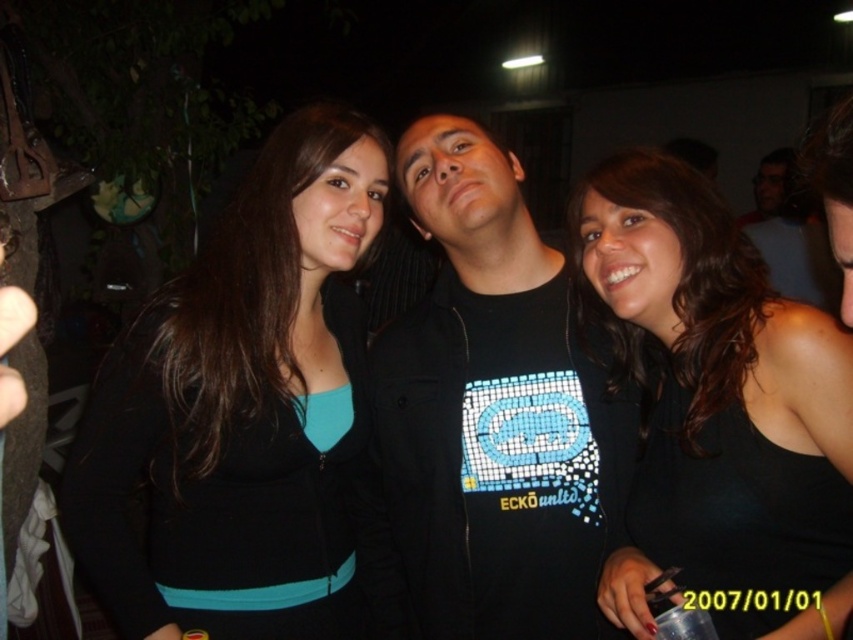
Question: Is black matte jacket at left further to camera compared to black matte tank top at center?

Choices:
 (A) no
 (B) yes

Answer: (B)

Question: Estimate the real-world distances between objects in this image. Which object is closer to the black matte shirt at center?

Choices:
 (A) black matte jacket at left
 (B) black matte tank top at center

Answer: (B)

Question: Considering the relative positions of black matte jacket at left and black matte tank top at center in the image provided, where is black matte jacket at left located with respect to black matte tank top at center?

Choices:
 (A) right
 (B) left

Answer: (B)

Question: Among these points, which one is farthest from the camera?

Choices:
 (A) (328, 112)
 (B) (724, 220)
 (C) (451, 268)

Answer: (C)

Question: Can you confirm if black matte shirt at center is smaller than black matte tank top at center?

Choices:
 (A) no
 (B) yes

Answer: (A)

Question: Which point is closer to the camera taking this photo?

Choices:
 (A) (520, 317)
 (B) (653, 518)

Answer: (B)